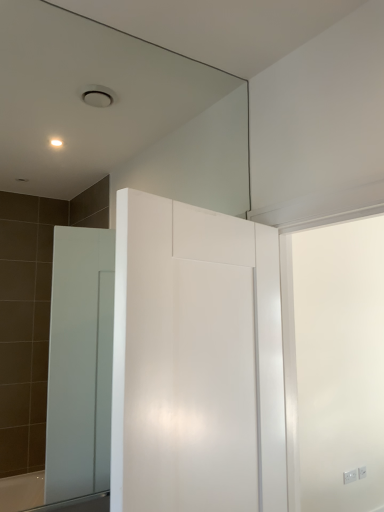
The image size is (384, 512). What are the coordinates of `white glossy door at center` in the screenshot? It's located at (196, 361).

The height and width of the screenshot is (512, 384). Describe the element at coordinates (196, 361) in the screenshot. I see `white glossy door at center` at that location.

What is the approximate height of white glossy door at center?

37.42 inches.

In order to click on white glossy door at center in this screenshot , I will do `click(196, 361)`.